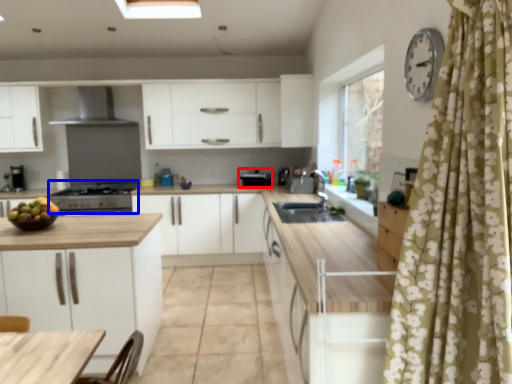
Question: Which object appears farthest to the camera in this image, appliance (highlighted by a red box) or appliance (highlighted by a blue box)?

Choices:
 (A) appliance
 (B) appliance

Answer: (A)